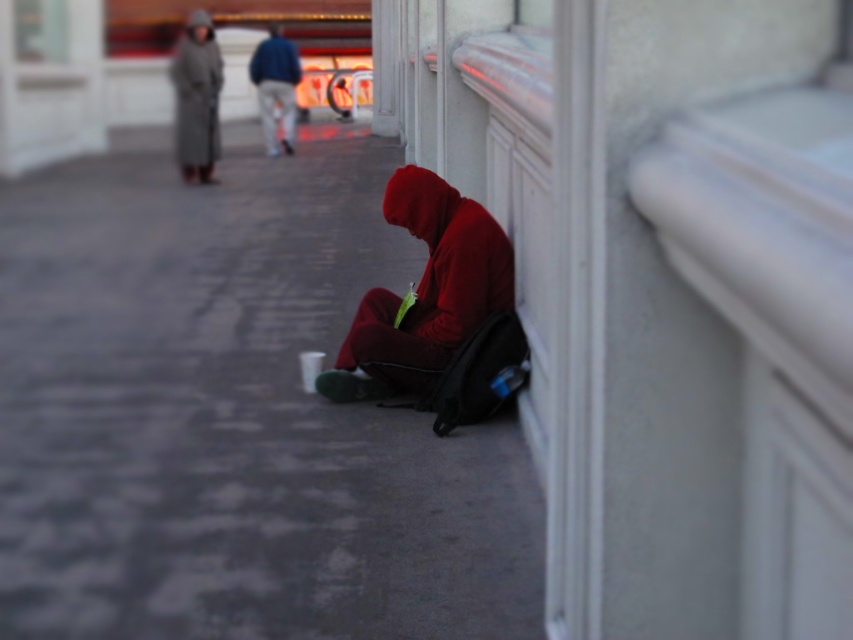
You are a delivery person who needs to place a package on the gray concrete pavement at lower left or the blue denim jeans at center. Which surface is more suitable for placing the package?

The gray concrete pavement at lower left is smaller than blue denim jeans at center, so the blue denim jeans at center is not a stable surface. The gray concrete pavement at lower left is more suitable for placing the package since it is a solid surface and the jeans might belong to someone.

You are standing at the center of the street scene. You need to place a small marker exactly at the gray concrete pavement at lower left. What are the coordinates where you should place the marker?

The coordinates for the gray concrete pavement at lower left are at point (231, 412).

You are standing at the point labeled as point (483, 218) and want to move to the point labeled as point (274, 100). Which direction should you face to walk towards it?

You should face towards the lower left direction because point (274, 100) is located to the lower left of point (483, 218).